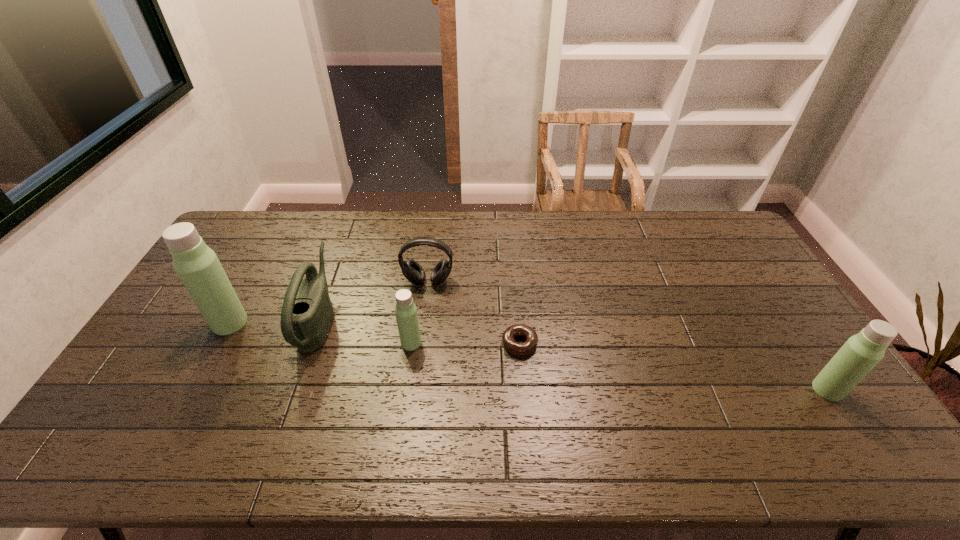
Where is `empty space between the headset and the shortest thermos bottle`? This screenshot has width=960, height=540. empty space between the headset and the shortest thermos bottle is located at coordinates (420, 312).

The width and height of the screenshot is (960, 540). I want to click on free space between the doughnut and the headset, so click(x=474, y=312).

Identify the location of object that stands as the second closest to the second shortest thermos bottle. (413, 272).

Choose which object is the third nearest neighbor to the fifth object from right to left. Please provide its 2D coordinates. Your answer should be formatted as a tuple, i.e. [(x, y)], where the tuple contains the x and y coordinates of a point satisfying the conditions above.

[(406, 314)]

At what (x,y) coordinates should I click in order to perform the action: click on thermos bottle that can be found as the closest to the headset. Please return your answer as a coordinate pair (x, y). The image size is (960, 540). Looking at the image, I should click on (406, 314).

Identify which thermos bottle is the nearest to the headset. Please provide its 2D coordinates. Your answer should be formatted as a tuple, i.e. [(x, y)], where the tuple contains the x and y coordinates of a point satisfying the conditions above.

[(406, 314)]

This screenshot has height=540, width=960. Find the location of `free spot that satisfies the following two spatial constraints: 1. on the earcups of the headset; 2. on the left side of the nearest object`. free spot that satisfies the following two spatial constraints: 1. on the earcups of the headset; 2. on the left side of the nearest object is located at coordinates click(415, 390).

I want to click on free space that satisfies the following two spatial constraints: 1. on the front side of the shortest object; 2. on the right side of the leftmost thermos bottle, so click(x=218, y=343).

At what (x,y) coordinates should I click in order to perform the action: click on vacant region that satisfies the following two spatial constraints: 1. on the spout of the watering can; 2. on the front side of the tallest object. Please return your answer as a coordinate pair (x, y). This screenshot has width=960, height=540. Looking at the image, I should click on (319, 322).

Where is `free spot that satisfies the following two spatial constraints: 1. on the spout of the fifth object from left to right; 2. on the right side of the watering can`? The width and height of the screenshot is (960, 540). free spot that satisfies the following two spatial constraints: 1. on the spout of the fifth object from left to right; 2. on the right side of the watering can is located at coordinates (311, 343).